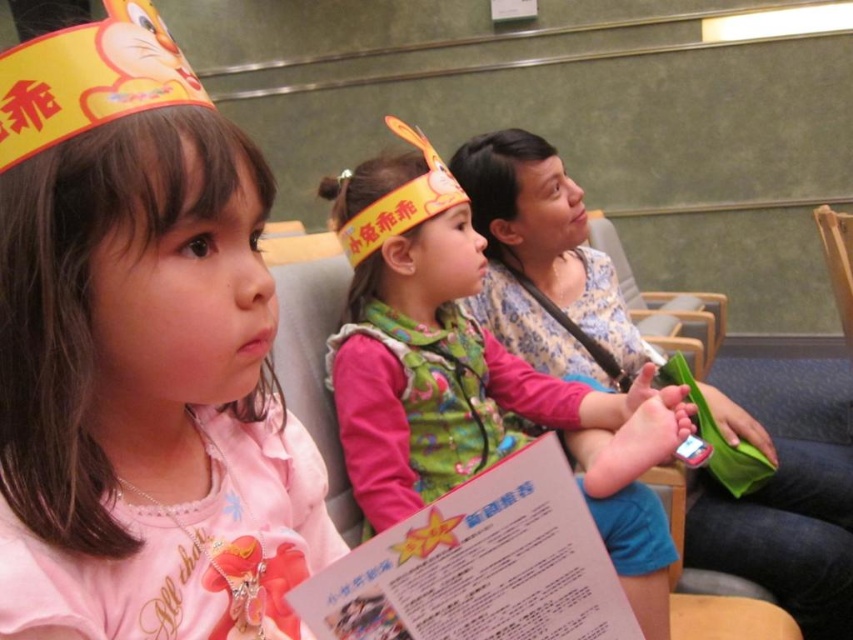
Question: Is pink fabric shirt at center bigger than matte pink shirt at center?

Choices:
 (A) yes
 (B) no

Answer: (B)

Question: Among these points, which one is farthest from the camera?

Choices:
 (A) (354, 376)
 (B) (136, 77)

Answer: (A)

Question: Which of the following is the closest to the observer?

Choices:
 (A) (433, 364)
 (B) (15, 618)

Answer: (B)

Question: Can you confirm if pink fabric shirt at center is wider than matte pink shirt at center?

Choices:
 (A) yes
 (B) no

Answer: (B)

Question: Which object appears farthest from the camera in this image?

Choices:
 (A) pink fabric shirt at center
 (B) matte pink shirt at center

Answer: (B)

Question: Does pink fabric shirt at center appear on the right side of matte pink shirt at center?

Choices:
 (A) yes
 (B) no

Answer: (B)